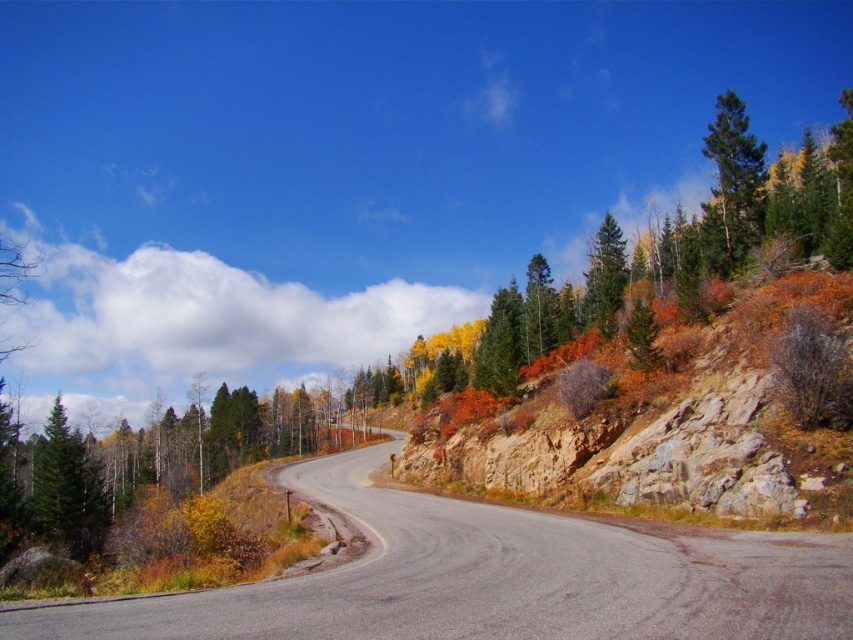
Which is more to the left, green matte tree at upper right or green matte tree at left?

green matte tree at left is more to the left.

Does green matte tree at upper right have a greater width compared to green matte tree at left?

No, green matte tree at upper right is not wider than green matte tree at left.

Who is more forward, (x=727, y=148) or (x=53, y=412)?

Point (x=53, y=412) is more forward.

You are a GUI agent. You are given a task and a screenshot of the screen. Output one action in this format:
    pyautogui.click(x=<x>, y=<y>)
    Task: Click on the green matte tree at upper right
    The image size is (853, 640).
    Given the screenshot: What is the action you would take?
    pyautogui.click(x=732, y=188)

Who is taller, autumn foliage at right or green matte tree at left?

Standing taller between the two is green matte tree at left.

Is the position of autumn foliage at right more distant than that of green matte tree at left?

No, it is not.

Is point (582, 433) farther from viewer compared to point (33, 456)?

No, (582, 433) is in front of (33, 456).

Locate an element on the screen. This screenshot has width=853, height=640. autumn foliage at right is located at coordinates (669, 420).

In the scene shown: Measure the distance from asphalt road at center to autumn foliage at right.

9.27 meters

Is point (560, 625) positioned before point (801, 497)?

Yes, it is.

Find the location of a particular element. The height and width of the screenshot is (640, 853). asphalt road at center is located at coordinates (496, 577).